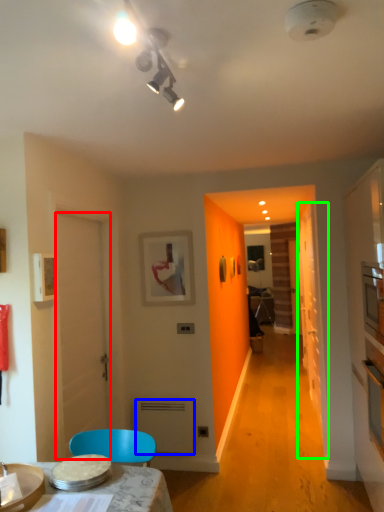
Question: Considering the real-world distances, which object is farthest from door (highlighted by a red box)? appliance (highlighted by a blue box) or glass door (highlighted by a green box)?

Choices:
 (A) appliance
 (B) glass door

Answer: (B)